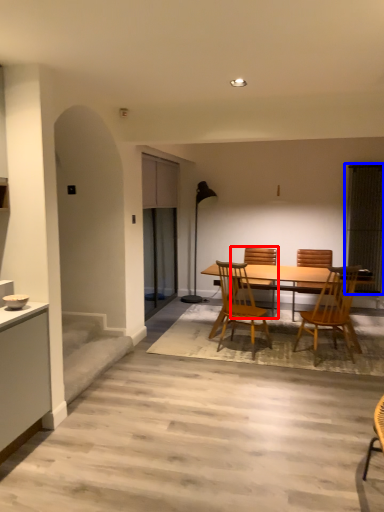
Question: Which of the following is the closest to the observer, chair (highlighted by a red box) or window screen (highlighted by a blue box)?

Choices:
 (A) chair
 (B) window screen

Answer: (A)